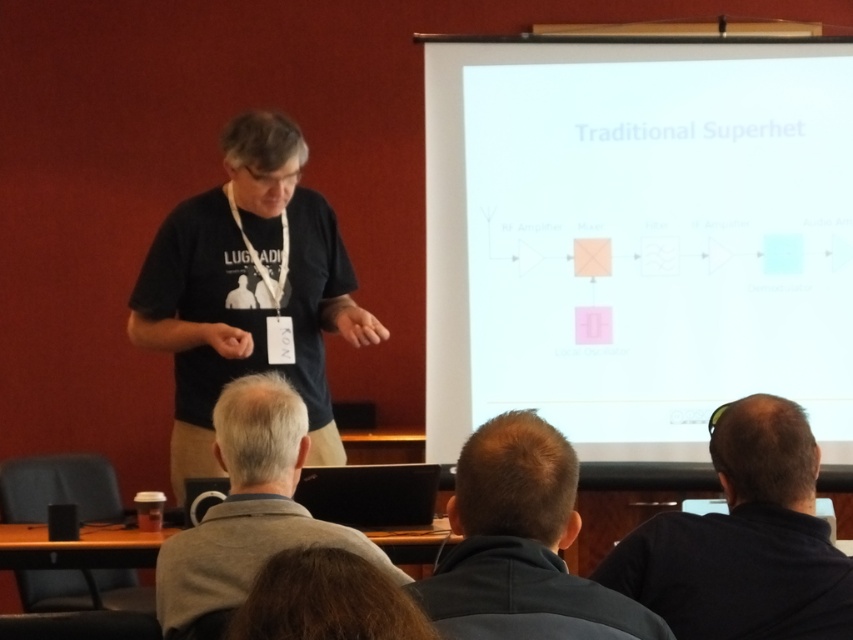
You are an attendee in the presentation and want to take a photo of the white paper at upper center and dark brown hair at lower center. Which object should you focus on first if you want to capture both in a single frame without moving the camera?

You should focus on the white paper at upper center first because its width is larger than the dark brown hair at lower center, making it easier to frame both objects in a single shot without moving the camera.